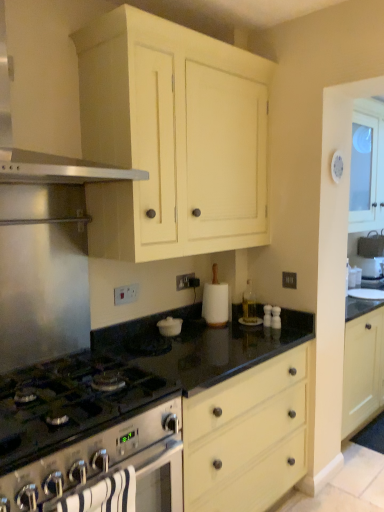
Question: From a real-world perspective, is satin silver range hood at upper left physically located above or below satin silver gas stove at lower left?

Choices:
 (A) below
 (B) above

Answer: (B)

Question: In terms of width, does satin silver range hood at upper left look wider or thinner when compared to satin silver gas stove at lower left?

Choices:
 (A) thin
 (B) wide

Answer: (A)

Question: Considering the real-world distances, which object is closest to the matte cream cabinet at upper center?

Choices:
 (A) clear glass bottle at center
 (B) satin silver range hood at upper left
 (C) satin silver gas stove at lower left
 (D) satin silver oven at lower left
 (E) black granite countertop at center

Answer: (B)

Question: Based on their relative distances, which object is nearer to the satin silver oven at lower left?

Choices:
 (A) satin silver range hood at upper left
 (B) matte cream cabinet at upper center
 (C) satin silver gas stove at lower left
 (D) clear glass bottle at center
 (E) black granite countertop at center

Answer: (C)